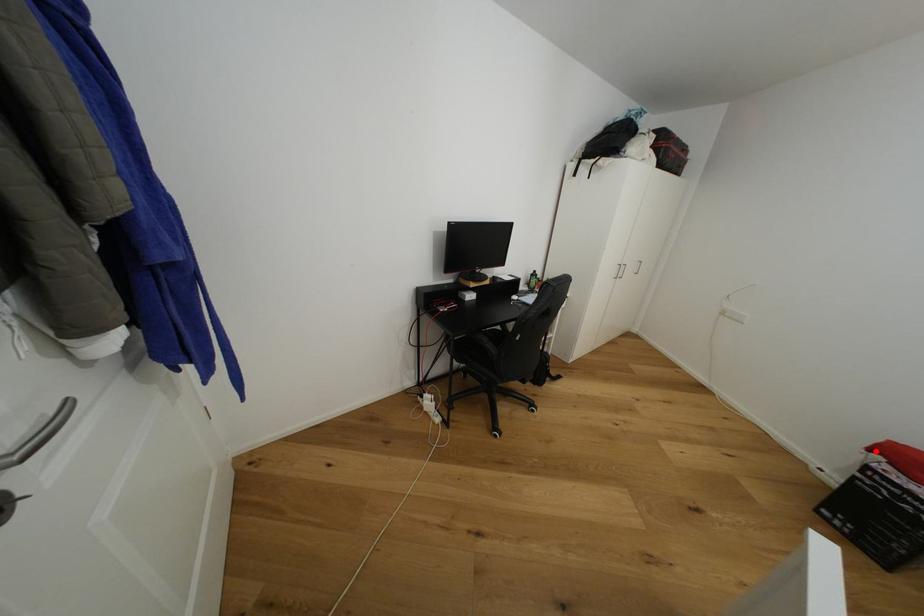
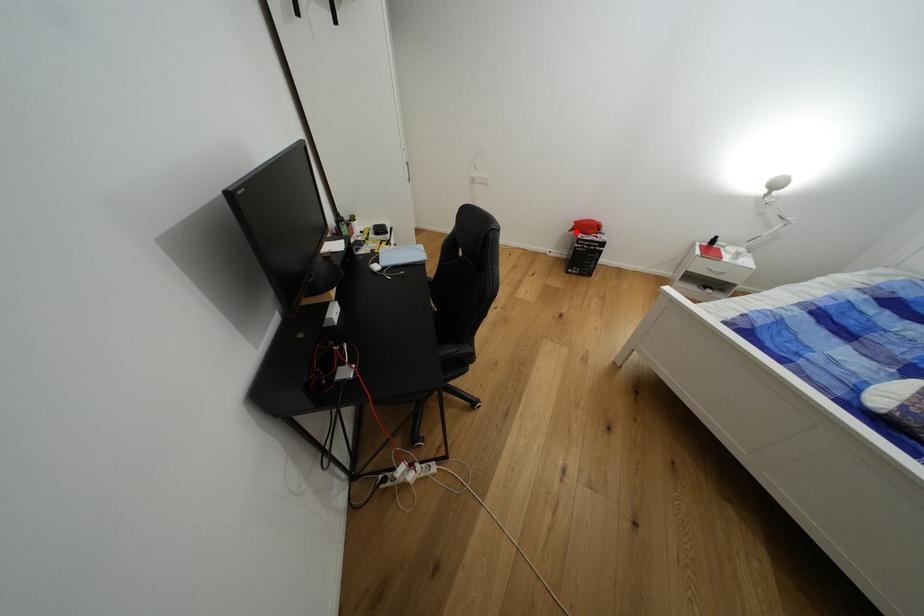
I am providing you with two images of the same scene from different viewpoints. A red point is marked on the first image and another point is marked on the second image. Is the red point in image1 aligned with the point shown in image2?

Yes